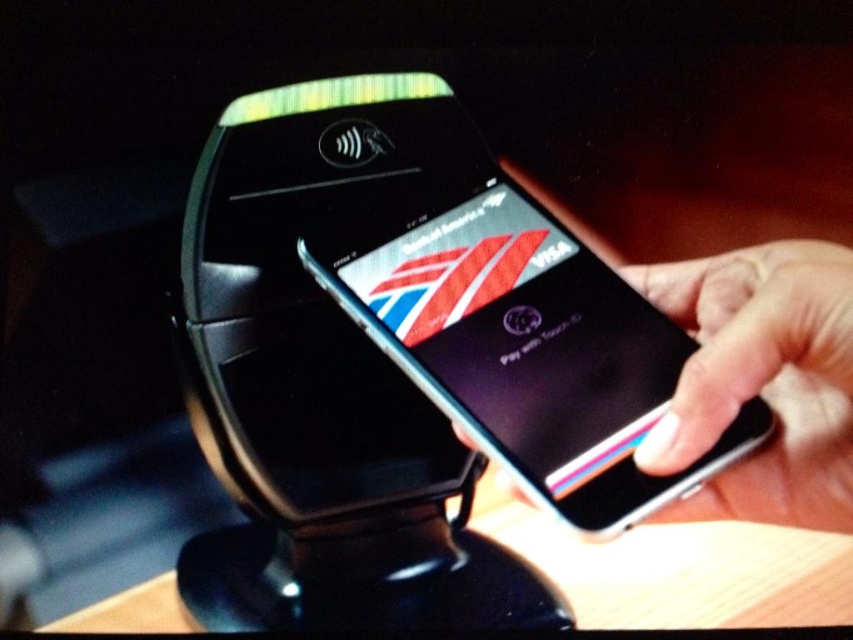
You are setting up a display for a tech store and need to arrange two phones. The metallic silver smartphone at center and the white matte phone at right must be placed on a shelf. According to the image, which phone should be placed higher on the shelf?

The metallic silver smartphone at center should be placed higher on the shelf since it is located above the white matte phone at right in the image.

You are a customer trying to pay at a store. You have two phones, a metallic silver smartphone at center and a white matte phone at right. Which phone should you use if you want to pay with the one closer to the POS terminal?

The metallic silver smartphone at center is positioned on the left side of the white matte phone at right, so the metallic silver smartphone at center is closer to the POS terminal and should be used for payment.

You are a delivery person who needs to place both the metallic silver smartphone at center and the white matte phone at right on a shelf. The shelf has a width of 4 inches. Can both phones fit side by side on the shelf without overlapping?

The distance between the metallic silver smartphone at center and the white matte phone at right is 3.79 inches, which is less than the shelf width of 4 inches. Therefore, both phones can fit side by side on the shelf without overlapping.